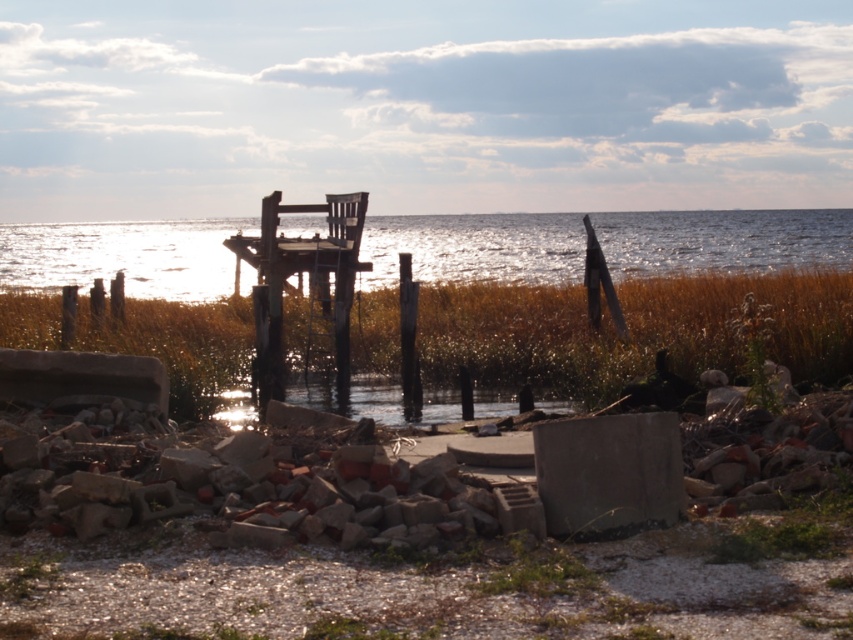
Which is above, glistening water at center or wooden dock at center?

glistening water at center is higher up.

Which of these two, glistening water at center or wooden dock at center, stands shorter?

Standing shorter between the two is wooden dock at center.

Is point (376, 243) less distant than point (341, 276)?

That is False.

This screenshot has height=640, width=853. Find the location of `glistening water at center`. glistening water at center is located at coordinates (123, 257).